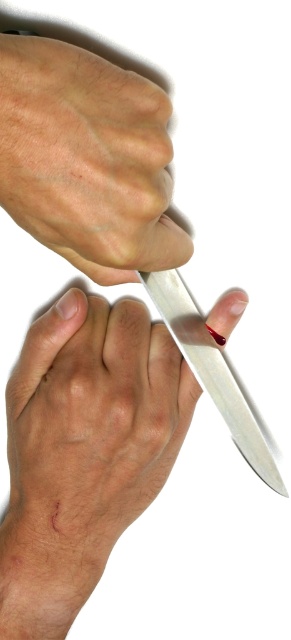
Question: Is smooth skin hand at center positioned before matte skin hand at upper center?

Choices:
 (A) yes
 (B) no

Answer: (B)

Question: Which is nearer to the polished metal knife at lower right?

Choices:
 (A) matte skin hand at upper center
 (B) smooth skin hand at center

Answer: (B)

Question: Is smooth skin hand at center bigger than matte skin hand at upper center?

Choices:
 (A) yes
 (B) no

Answer: (B)

Question: Does smooth skin hand at center come in front of polished metal knife at lower right?

Choices:
 (A) no
 (B) yes

Answer: (B)

Question: Estimate the real-world distances between objects in this image. Which object is closer to the smooth skin hand at center?

Choices:
 (A) matte skin hand at upper center
 (B) polished metal knife at lower right

Answer: (B)

Question: Which of the following is the closest to the observer?

Choices:
 (A) (59, 342)
 (B) (247, 408)
 (C) (38, 195)

Answer: (C)